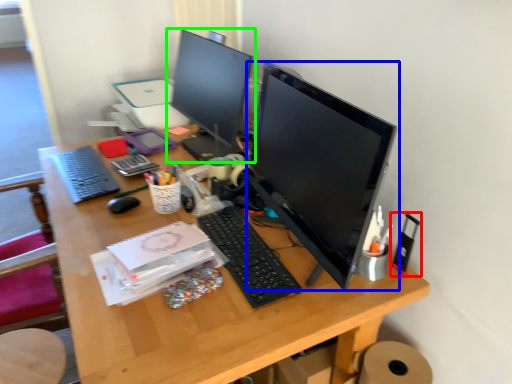
Question: Considering the real-world distances, which object is farthest from stationery (highlighted by a red box)? computer monitor (highlighted by a blue box) or computer monitor (highlighted by a green box)?

Choices:
 (A) computer monitor
 (B) computer monitor

Answer: (B)